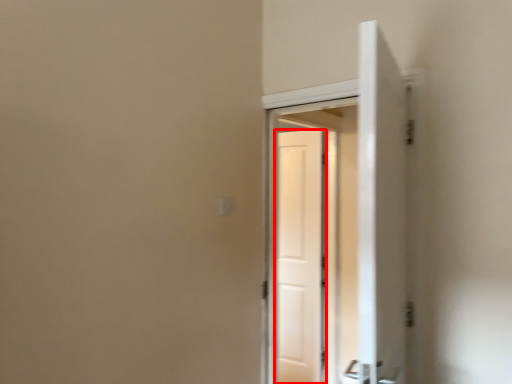
Question: Considering the relative positions of door (annotated by the red box) and screen door in the image provided, where is door (annotated by the red box) located with respect to the staircase?

Choices:
 (A) left
 (B) right

Answer: (B)